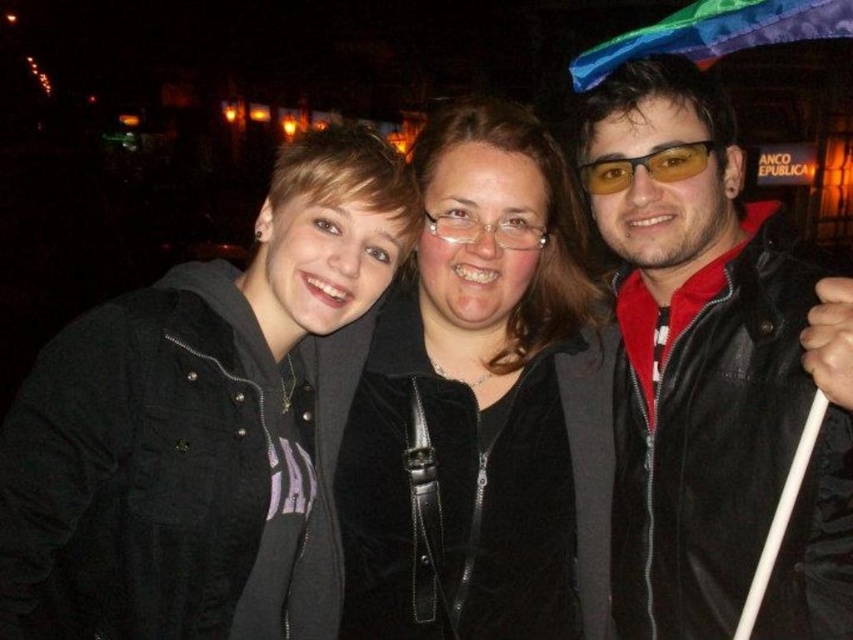
Question: Which point is farther to the camera?

Choices:
 (A) yellow tinted plastic glasses at center
 (B) matte black jacket at right

Answer: (A)

Question: Does matte black jacket at right have a smaller size compared to yellow tinted plastic glasses at center?

Choices:
 (A) yes
 (B) no

Answer: (B)

Question: Does velvet black jacket at center have a smaller size compared to yellow tinted plastic glasses at center?

Choices:
 (A) no
 (B) yes

Answer: (A)

Question: Is matte black jacket at right smaller than yellow tinted plastic glasses at center?

Choices:
 (A) yes
 (B) no

Answer: (B)

Question: Which of these objects is positioned farthest from the matte black jacket at right?

Choices:
 (A) velvet black jacket at center
 (B) yellow tinted plastic glasses at center

Answer: (A)

Question: Which point appears closest to the camera in this image?

Choices:
 (A) (434, 161)
 (B) (607, 160)
 (C) (776, 376)

Answer: (C)